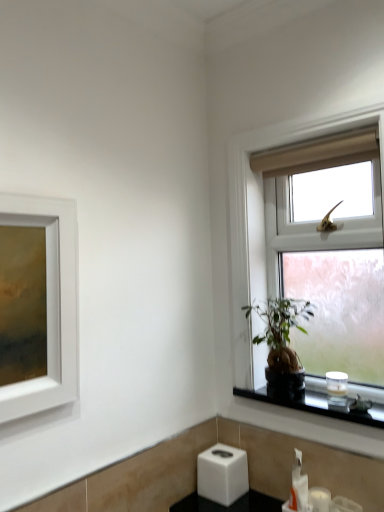
The image size is (384, 512). Identify the location of black glass candle at right. point(315,404).

What do you see at coordinates (320, 272) in the screenshot? I see `clear glass window at upper right` at bounding box center [320, 272].

What is the approximate height of white plastic soap dispenser at lower right?

white plastic soap dispenser at lower right is 19.93 centimeters in height.

This screenshot has height=512, width=384. I want to click on black glass candle at right, so click(315, 404).

Which object is more forward, black glass candle at right or white plastic soap dispenser at lower right?

black glass candle at right.

Does black glass candle at right have a greater height compared to white plastic soap dispenser at lower right?

No.

The height and width of the screenshot is (512, 384). In order to click on soap dispenser lying below the black glass candle at right (from the image's perspective) in this screenshot , I will do `click(298, 485)`.

Could you tell me if black glass candle at right is turned towards white plastic soap dispenser at lower right?

No, black glass candle at right is not turned towards white plastic soap dispenser at lower right.

From the picture: Is black glass candle at right at the back of white plastic soap dispenser at lower right?

No, white plastic soap dispenser at lower right is not facing the opposite direction of black glass candle at right.

Considering the positions of objects white plastic soap dispenser at lower right and black glass candle at right in the image provided, who is more to the right, white plastic soap dispenser at lower right or black glass candle at right?

Positioned to the right is black glass candle at right.

In the scene shown: Which point is more forward, (298, 471) or (284, 404)?

Positioned in front is point (298, 471).

From the image's perspective, is white plastic soap dispenser at lower right above or below black glass candle at right?

Based on their image positions, white plastic soap dispenser at lower right is located beneath black glass candle at right.

Is clear glass window at upper right bigger or smaller than white plastic soap dispenser at lower right?

clear glass window at upper right is bigger than white plastic soap dispenser at lower right.

Is clear glass window at upper right oriented away from white plastic soap dispenser at lower right?

No, clear glass window at upper right is not facing away from white plastic soap dispenser at lower right.

From the image's perspective, between clear glass window at upper right and white plastic soap dispenser at lower right, who is located below?

white plastic soap dispenser at lower right.

I want to click on houseplant above the black glass candle at right (from the image's perspective), so click(x=282, y=340).

From a real-world perspective, is black glass candle at right above or below green leafy plant at window?

In terms of real-world spatial position, black glass candle at right is below green leafy plant at window.

Can you confirm if black glass candle at right is shorter than green leafy plant at window?

Yes.

Based on the photo, is green leafy plant at window completely or partially outside of clear glass window at upper right?

Actually, green leafy plant at window is within clear glass window at upper right.

Which object is closer to the camera, green leafy plant at window or clear glass window at upper right?

Positioned in front is clear glass window at upper right.

Which is more to the right, green leafy plant at window or clear glass window at upper right?

clear glass window at upper right.

From the image's perspective, would you say white plastic soap dispenser at lower right is shown under green leafy plant at window?

Yes, from the image's perspective, white plastic soap dispenser at lower right is below green leafy plant at window.

Considering the sizes of objects white plastic soap dispenser at lower right and green leafy plant at window in the image provided, who is shorter, white plastic soap dispenser at lower right or green leafy plant at window?

white plastic soap dispenser at lower right is shorter.

Is white plastic soap dispenser at lower right situated inside green leafy plant at window or outside?

white plastic soap dispenser at lower right is not inside green leafy plant at window, it's outside.

Based on the photo, from a real-world perspective, is clear glass window at upper right over green leafy plant at window?

Yes, from a real-world perspective, clear glass window at upper right is above green leafy plant at window.

Does clear glass window at upper right have a greater height compared to green leafy plant at window?

Correct, clear glass window at upper right is much taller as green leafy plant at window.

From the image's perspective, between clear glass window at upper right and green leafy plant at window, which one is located above?

clear glass window at upper right, from the image's perspective.

Who is smaller, clear glass window at upper right or green leafy plant at window?

With smaller size is green leafy plant at window.

Where is `window sill on the right of the white plastic soap dispenser at lower right`? window sill on the right of the white plastic soap dispenser at lower right is located at coordinates (315, 404).

Identify the location of window sill above the white plastic soap dispenser at lower right (from the image's perspective). This screenshot has width=384, height=512. (315, 404).

From the image, which object appears to be farther from black glass candle at right, green leafy plant at window or white plastic soap dispenser at lower right?

Among the two, white plastic soap dispenser at lower right is located further to black glass candle at right.

Based on their spatial positions, is clear glass window at upper right or black glass candle at right closer to white plastic soap dispenser at lower right?

black glass candle at right lies closer to white plastic soap dispenser at lower right than the other object.

Looking at this image, estimate the real-world distances between objects in this image. Which object is further from black glass candle at right, clear glass window at upper right or white plastic soap dispenser at lower right?

clear glass window at upper right lies further to black glass candle at right than the other object.

From the image, which object appears to be nearer to white plastic soap dispenser at lower right, green leafy plant at window or black glass candle at right?

black glass candle at right is positioned closer to the anchor white plastic soap dispenser at lower right.

Based on the photo, based on their spatial positions, is green leafy plant at window or clear glass window at upper right further from white plastic soap dispenser at lower right?

clear glass window at upper right is positioned further to the anchor white plastic soap dispenser at lower right.

Estimate the real-world distances between objects in this image. Which object is closer to black glass candle at right, white plastic soap dispenser at lower right or green leafy plant at window?

green leafy plant at window.

Which object lies further to the anchor point white plastic soap dispenser at lower right, black glass candle at right or clear glass window at upper right?

The object further to white plastic soap dispenser at lower right is clear glass window at upper right.

Looking at the image, which one is located further to black glass candle at right, white plastic soap dispenser at lower right or clear glass window at upper right?

clear glass window at upper right is further to black glass candle at right.

Find the location of a particular element. window sill between green leafy plant at window and white plastic soap dispenser at lower right from top to bottom is located at coordinates (315, 404).

At what (x,y) coordinates should I click in order to perform the action: click on window sill between clear glass window at upper right and white plastic soap dispenser at lower right in the up-down direction. Please return your answer as a coordinate pair (x, y). Image resolution: width=384 pixels, height=512 pixels. Looking at the image, I should click on (315, 404).

Find the location of `houseplant between clear glass window at upper right and black glass candle at right in the vertical direction`. houseplant between clear glass window at upper right and black glass candle at right in the vertical direction is located at coordinates (282, 340).

Where is `houseplant between clear glass window at upper right and white plastic soap dispenser at lower right from top to bottom`? Image resolution: width=384 pixels, height=512 pixels. houseplant between clear glass window at upper right and white plastic soap dispenser at lower right from top to bottom is located at coordinates (282, 340).